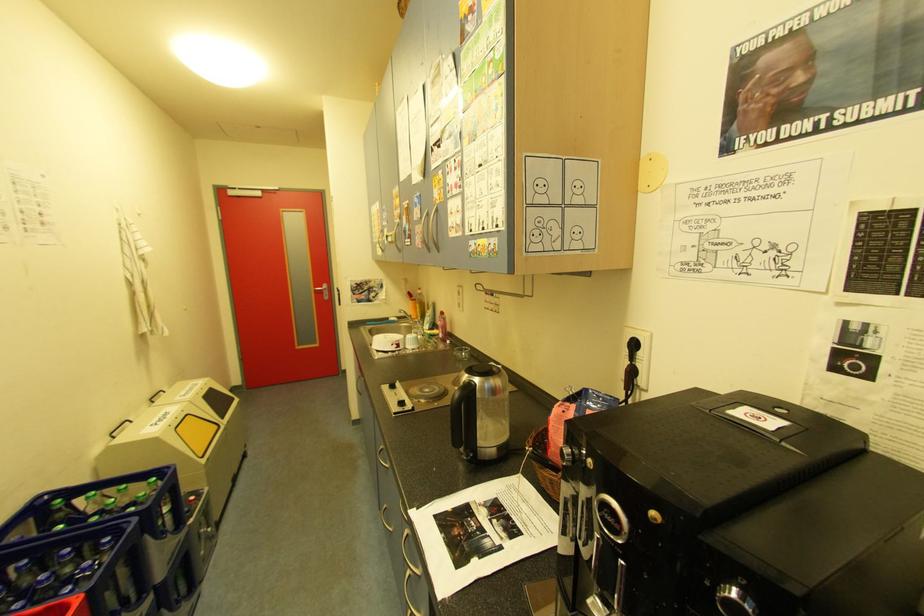
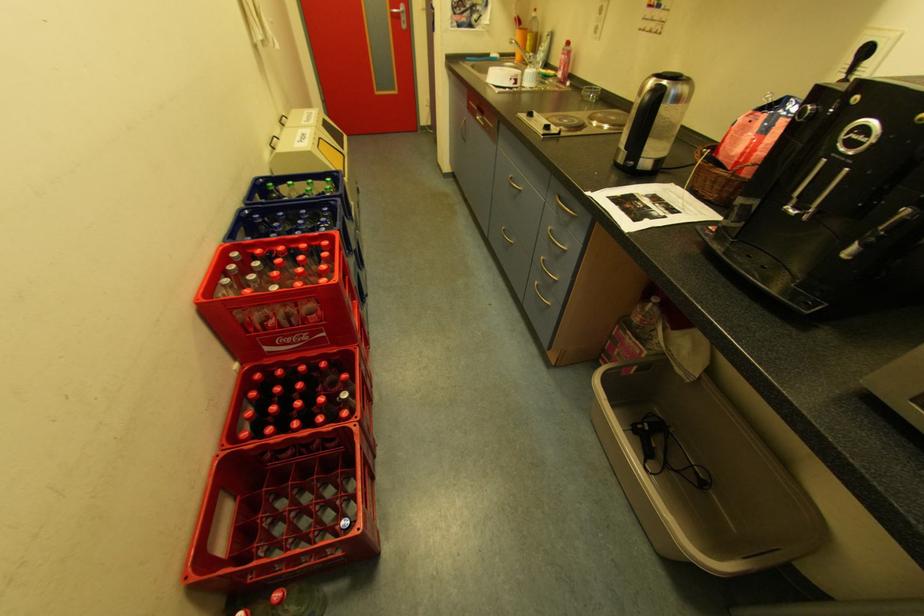
Question: How did the camera likely rotate?

Choices:
 (A) Left
 (B) Right
 (C) Up
 (D) Down

Answer: (D)